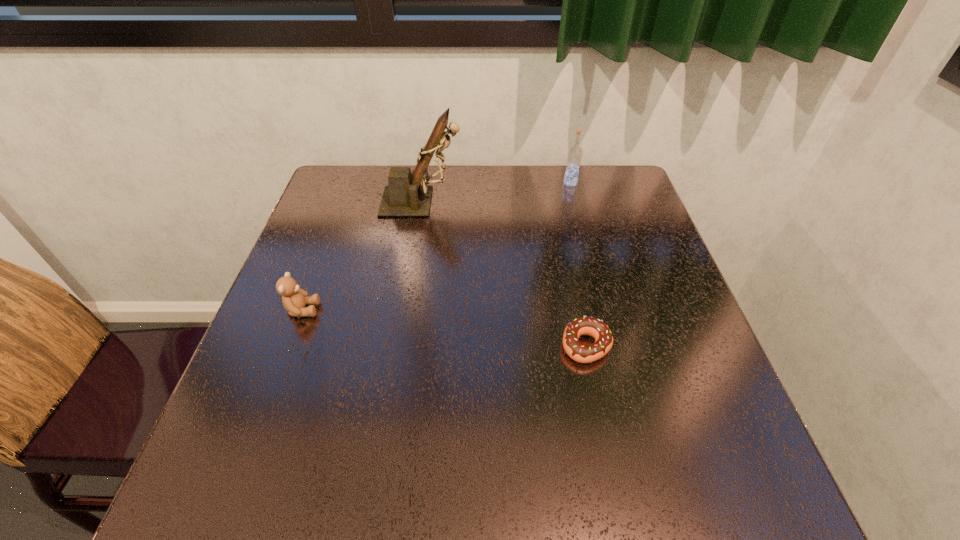
Where is `free space at the right edge of the desktop`? This screenshot has width=960, height=540. free space at the right edge of the desktop is located at coordinates 647,266.

Find the location of a particular element. blank area at the far left corner is located at coordinates (368, 183).

Where is `vacant space at the near left corner of the desktop`? This screenshot has height=540, width=960. vacant space at the near left corner of the desktop is located at coordinates (287, 510).

In the image, there is a desktop. Where is `vacant space at the far right corner`? The image size is (960, 540). vacant space at the far right corner is located at coordinates (604, 170).

At what (x,y) coordinates should I click in order to perform the action: click on free space at the near right corner. Please return your answer as a coordinate pair (x, y). The width and height of the screenshot is (960, 540). Looking at the image, I should click on (752, 509).

Where is `free area in between the second tallest object and the teddy bear`? The height and width of the screenshot is (540, 960). free area in between the second tallest object and the teddy bear is located at coordinates (437, 246).

Find the location of a particular element. This screenshot has height=540, width=960. empty space between the second tallest object and the nearest object is located at coordinates (578, 264).

At what (x,y) coordinates should I click in order to perform the action: click on unoccupied area between the shortest object and the vodka. Please return your answer as a coordinate pair (x, y). Looking at the image, I should click on (578, 264).

Image resolution: width=960 pixels, height=540 pixels. I want to click on vacant space in between the teddy bear and the shortest object, so click(444, 328).

Image resolution: width=960 pixels, height=540 pixels. In order to click on free space between the tallest object and the vodka in this screenshot , I will do `click(496, 192)`.